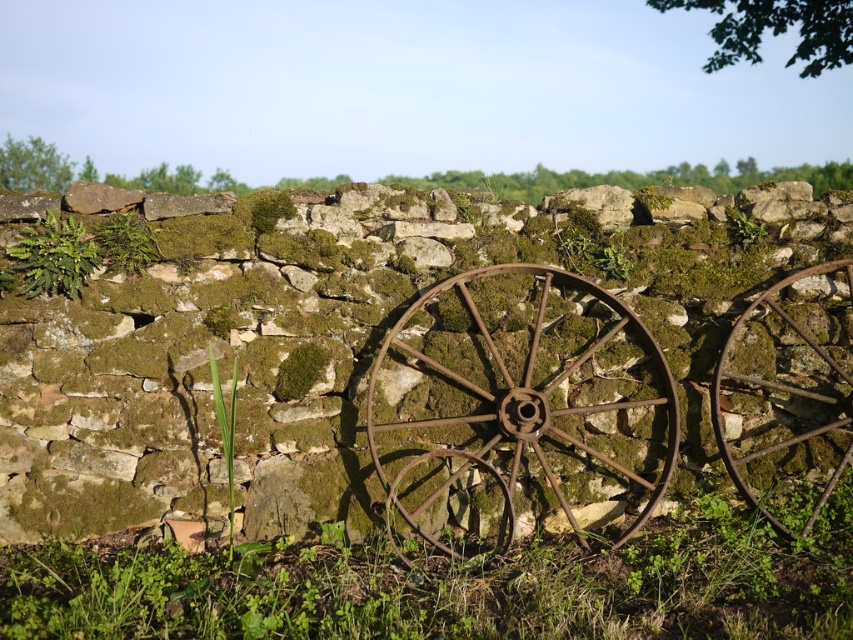
Question: Considering the real-world distances, which object is farthest from the green leafy weed at upper center?

Choices:
 (A) green mossy plant at upper left
 (B) rusty metal wagon wheel at right

Answer: (A)

Question: Which point is farther from the camera taking this photo?

Choices:
 (A) (44, 262)
 (B) (782, 467)

Answer: (B)

Question: Is rusty metal wheel at center wider than rusty metal wagon wheel at right?

Choices:
 (A) yes
 (B) no

Answer: (A)

Question: Can you confirm if green leafy grass at lower center is smaller than rusty metal wagon wheel at center?

Choices:
 (A) yes
 (B) no

Answer: (B)

Question: Is rusty metal wheel at center positioned before rusty metal wagon wheel at right?

Choices:
 (A) no
 (B) yes

Answer: (B)

Question: Which point is farther to the camera?

Choices:
 (A) rusty metal wagon wheel at center
 (B) green mossy plant at center
 (C) green leafy weed at upper center

Answer: (C)